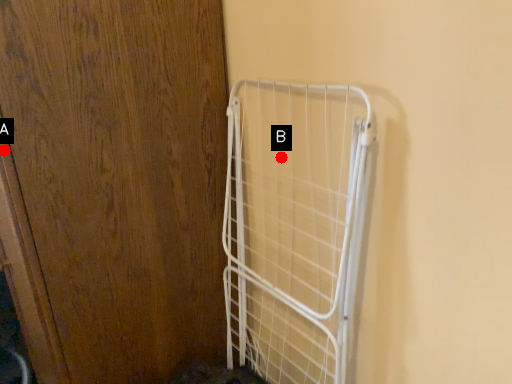
Question: Two points are circled on the image, labeled by A and B beside each circle. Which point appears farthest from the camera in this image?

Choices:
 (A) A is further
 (B) B is further

Answer: (B)